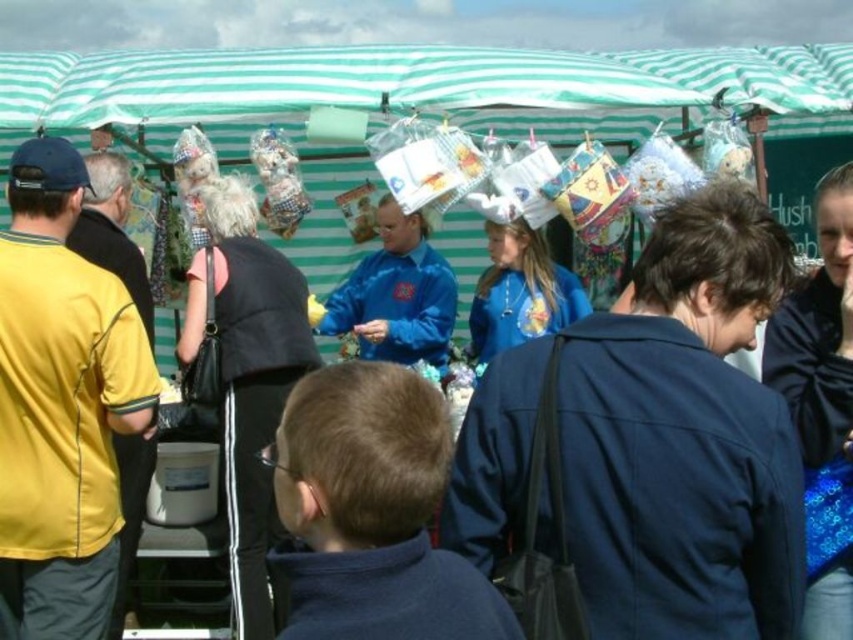
Which is more to the left, blue velvet jacket at center or blue matte shirt at center?

Positioned to the left is blue velvet jacket at center.

Is the position of blue velvet jacket at center less distant than that of blue matte shirt at center?

No, it is behind blue matte shirt at center.

What do you see at coordinates (396, 294) in the screenshot? I see `blue velvet jacket at center` at bounding box center [396, 294].

Image resolution: width=853 pixels, height=640 pixels. I want to click on blue velvet jacket at center, so click(x=396, y=294).

Is point (706, 404) behind point (552, 300)?

No, (706, 404) is in front of (552, 300).

Who is higher up, dark blue jacket at center or blue matte shirt at center?

Positioned higher is blue matte shirt at center.

Is point (782, 468) more distant than point (537, 316)?

No, it is not.

Identify the location of dark blue jacket at center. (654, 440).

Is point (19, 384) behind point (523, 289)?

No, it is in front of (523, 289).

Can you confirm if yellow fabric shirt at left is bigger than blue matte shirt at center?

Correct, yellow fabric shirt at left is larger in size than blue matte shirt at center.

Image resolution: width=853 pixels, height=640 pixels. Identify the location of yellow fabric shirt at left. (61, 406).

Locate an element on the screen. Image resolution: width=853 pixels, height=640 pixels. yellow fabric shirt at left is located at coordinates (61, 406).